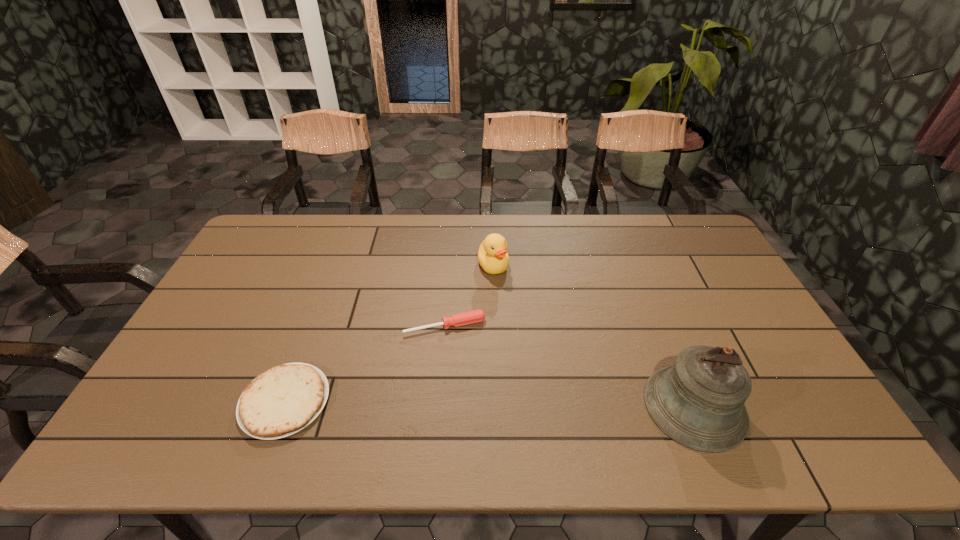
At what (x,y) coordinates should I click in order to perform the action: click on empty space that is in between the leftmost object and the rightmost object. Please return your answer as a coordinate pair (x, y). The width and height of the screenshot is (960, 540). Looking at the image, I should click on pyautogui.click(x=490, y=404).

Locate an element on the screen. This screenshot has height=540, width=960. blank region between the leftmost object and the second tallest object is located at coordinates (389, 333).

The image size is (960, 540). In order to click on free spot between the duck and the rightmost object in this screenshot , I will do click(x=594, y=336).

At what (x,y) coordinates should I click in order to perform the action: click on object that is the closest to the rightmost object. Please return your answer as a coordinate pair (x, y). The width and height of the screenshot is (960, 540). Looking at the image, I should click on (476, 316).

Locate which object is the third closest to the second farthest object. Please provide its 2D coordinates. Your answer should be formatted as a tuple, i.e. [(x, y)], where the tuple contains the x and y coordinates of a point satisfying the conditions above.

[(698, 401)]

Identify the location of free space that satisfies the following two spatial constraints: 1. on the back side of the farthest object; 2. on the right side of the leftmost object. The width and height of the screenshot is (960, 540). (336, 265).

At what (x,y) coordinates should I click in order to perform the action: click on free space that satisfies the following two spatial constraints: 1. on the back side of the second farthest object; 2. on the left side of the farthest object. Please return your answer as a coordinate pair (x, y). Looking at the image, I should click on (449, 265).